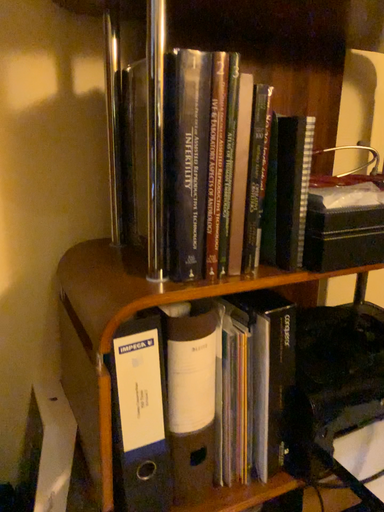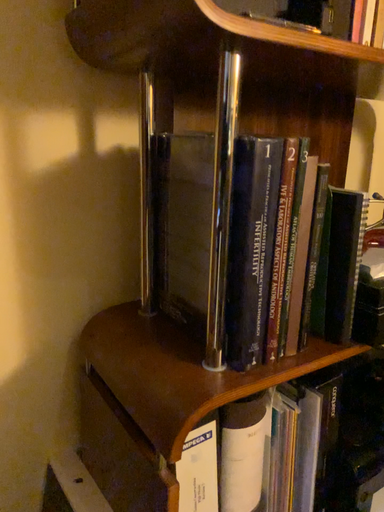
Question: How did the camera likely rotate when shooting the video?

Choices:
 (A) rotated right
 (B) rotated left

Answer: (A)